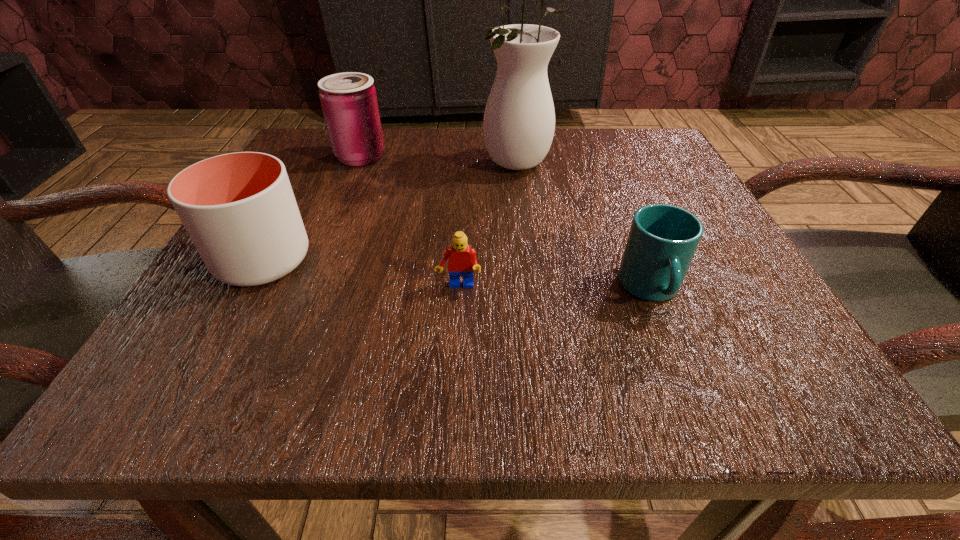
Find the location of a particular element. The width and height of the screenshot is (960, 540). free space at the near edge is located at coordinates (334, 396).

Where is `vacant space at the left edge of the desktop`? vacant space at the left edge of the desktop is located at coordinates (213, 292).

The width and height of the screenshot is (960, 540). I want to click on vacant space at the far left corner of the desktop, so click(x=320, y=151).

You are a GUI agent. You are given a task and a screenshot of the screen. Output one action in this format:
    pyautogui.click(x=<x>, y=<y>)
    Task: Click on the free space at the near left corner of the desktop
    This screenshot has width=960, height=540.
    Given the screenshot: What is the action you would take?
    pyautogui.click(x=133, y=400)

At what (x,y) coordinates should I click in order to perform the action: click on free region at the far right corner. Please return your answer as a coordinate pair (x, y). Image resolution: width=960 pixels, height=540 pixels. Looking at the image, I should click on click(x=632, y=129).

You are a GUI agent. You are given a task and a screenshot of the screen. Output one action in this format:
    pyautogui.click(x=<x>, y=<y>)
    Task: Click on the empty location between the can and the shortest object
    
    Given the screenshot: What is the action you would take?
    pyautogui.click(x=410, y=222)

Identify the location of free spot between the Lego and the shorter cup. The image size is (960, 540). (555, 288).

Locate an element on the screen. empty space that is in between the vase and the shortest object is located at coordinates (489, 226).

You are a GUI agent. You are given a task and a screenshot of the screen. Output one action in this format:
    pyautogui.click(x=<x>, y=<y>)
    Task: Click on the vacant area that lies between the right cup and the Lego
    
    Given the screenshot: What is the action you would take?
    pyautogui.click(x=555, y=288)

Locate an element on the screen. This screenshot has width=960, height=540. empty location between the can and the Lego is located at coordinates (410, 222).